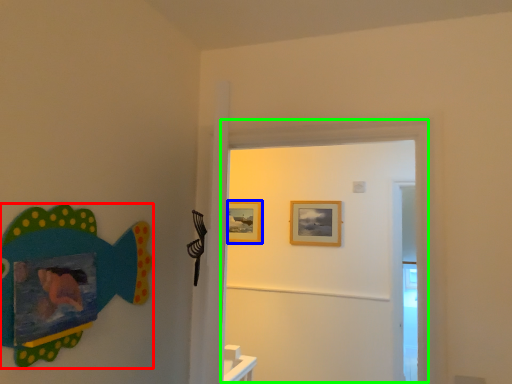
Question: Which object is the farthest from fish (highlighted by a red box)? Choose among these: picture frame (highlighted by a blue box) or door (highlighted by a green box).

Choices:
 (A) picture frame
 (B) door

Answer: (A)